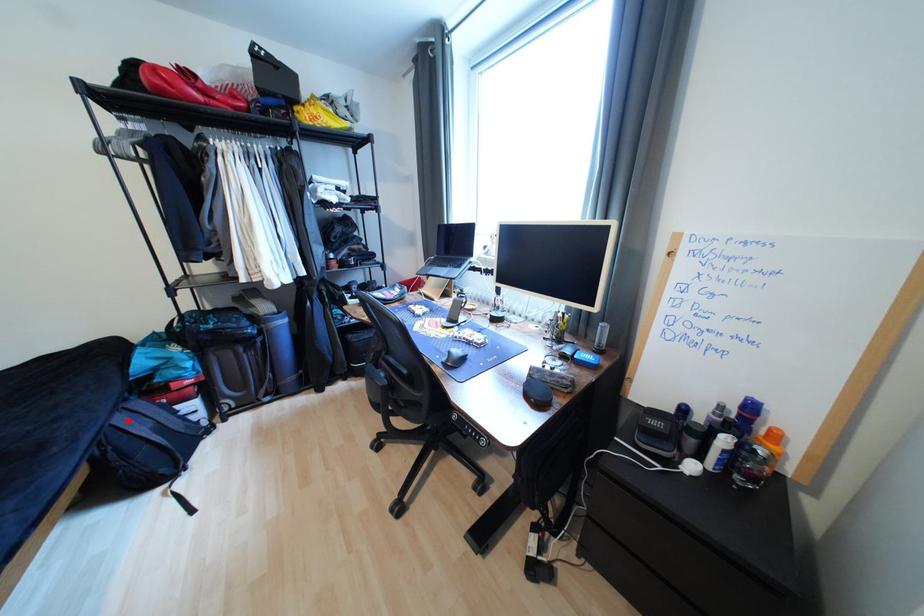
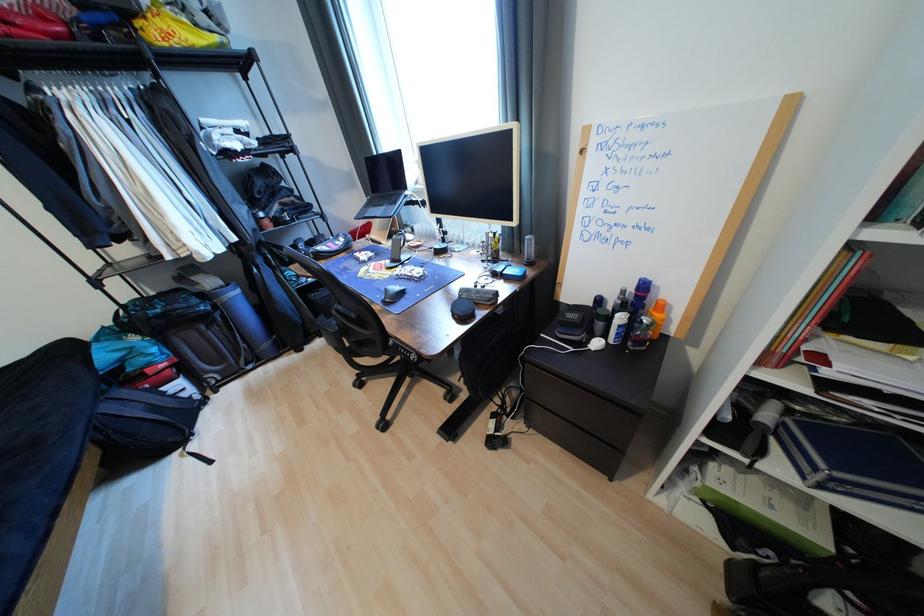
Question: I am providing you with two images of the same scene from different viewpoints. Image1 has a red point marked. In image2, the corresponding 3D location appears at what relative position? Reply with the corresponding letter.

Choices:
 (A) Closer
 (B) Farther

Answer: (A)